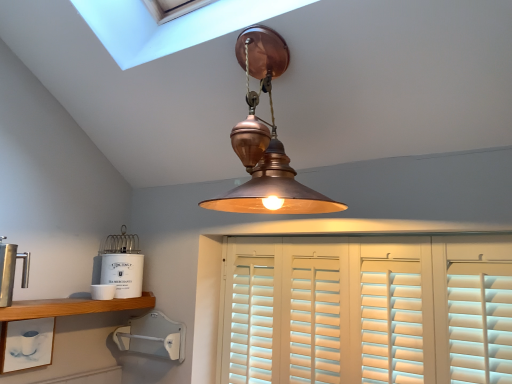
Question: From the image's perspective, is polished stainless steel coffee press at left, which ranks as the fourth appliance in bottom-to-top order, located above white wood shutters at center?

Choices:
 (A) no
 (B) yes

Answer: (B)

Question: Is the position of polished stainless steel coffee press at left, the 1th appliance viewed from the top, more distant than that of white wood shutters at center?

Choices:
 (A) no
 (B) yes

Answer: (B)

Question: Does polished stainless steel coffee press at left, which ranks as the fourth appliance in bottom-to-top order, have a smaller size compared to white wood shutters at center?

Choices:
 (A) yes
 (B) no

Answer: (A)

Question: Does polished stainless steel coffee press at left, which ranks as the fourth appliance in bottom-to-top order, have a lesser height compared to white wood shutters at center?

Choices:
 (A) no
 (B) yes

Answer: (B)

Question: Is polished stainless steel coffee press at left, the 1th appliance viewed from the top, facing away from white wood shutters at center?

Choices:
 (A) yes
 (B) no

Answer: (B)

Question: Looking at the image, does wooden shelf at lower left, the 1th shelf positioned from the top, seem bigger or smaller compared to copper pendant light at center?

Choices:
 (A) big
 (B) small

Answer: (B)

Question: From a real-world perspective, relative to copper pendant light at center, is wooden shelf at lower left, acting as the 2th shelf starting from the bottom, vertically above or below?

Choices:
 (A) above
 (B) below

Answer: (B)

Question: Is wooden shelf at lower left, acting as the 2th shelf starting from the bottom, taller or shorter than copper pendant light at center?

Choices:
 (A) short
 (B) tall

Answer: (A)

Question: Is point (x=6, y=309) closer or farther from the camera than point (x=283, y=193)?

Choices:
 (A) closer
 (B) farther

Answer: (B)

Question: From a real-world perspective, is white matte tea canister at left, which ranks as the third appliance in bottom-to-top order, physically located above or below copper pendant light at center?

Choices:
 (A) below
 (B) above

Answer: (A)

Question: Considering the positions of white matte tea canister at left, which is counted as the 2th appliance, starting from the top, and copper pendant light at center in the image, is white matte tea canister at left, which is counted as the 2th appliance, starting from the top, wider or thinner than copper pendant light at center?

Choices:
 (A) wide
 (B) thin

Answer: (B)

Question: Looking at the image, does white matte tea canister at left, which is counted as the 2th appliance, starting from the top, seem bigger or smaller compared to copper pendant light at center?

Choices:
 (A) big
 (B) small

Answer: (B)

Question: Considering the relative positions of white matte tea canister at left, which is counted as the 2th appliance, starting from the top, and copper pendant light at center in the image provided, is white matte tea canister at left, which is counted as the 2th appliance, starting from the top, to the left or to the right of copper pendant light at center?

Choices:
 (A) right
 (B) left

Answer: (B)

Question: Is white matte cup at lower left, the 2th shelf in the top-to-bottom sequence, bigger or smaller than white matte tea canister at left, which is counted as the 2th appliance, starting from the top?

Choices:
 (A) big
 (B) small

Answer: (B)

Question: From a real-world perspective, relative to white matte tea canister at left, which ranks as the third appliance in bottom-to-top order, is white matte cup at lower left, placed as the 1th shelf when sorted from bottom to top, vertically above or below?

Choices:
 (A) above
 (B) below

Answer: (B)